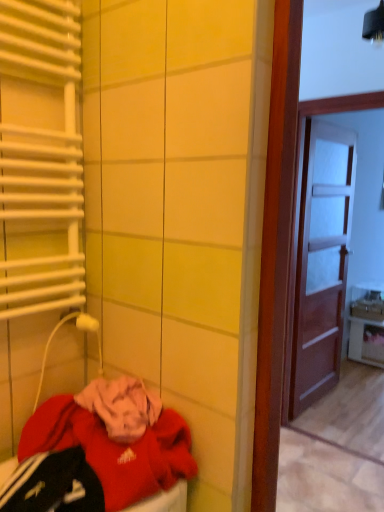
Question: Does white metallic radiator at left have a lesser width compared to white glossy cabinet at right?

Choices:
 (A) no
 (B) yes

Answer: (B)

Question: From the image's perspective, is white metallic radiator at left below white glossy cabinet at right?

Choices:
 (A) no
 (B) yes

Answer: (A)

Question: From a real-world perspective, is white metallic radiator at left located higher than white glossy cabinet at right?

Choices:
 (A) no
 (B) yes

Answer: (B)

Question: Does white metallic radiator at left come behind white glossy cabinet at right?

Choices:
 (A) yes
 (B) no

Answer: (B)

Question: Is white metallic radiator at left oriented towards white glossy cabinet at right?

Choices:
 (A) no
 (B) yes

Answer: (A)

Question: Does white metallic radiator at left have a lesser height compared to white glossy cabinet at right?

Choices:
 (A) yes
 (B) no

Answer: (B)

Question: Can you confirm if brown wooden door at right is bigger than white glossy cabinet at right?

Choices:
 (A) yes
 (B) no

Answer: (A)

Question: Considering the relative sizes of brown wooden door at right and white glossy cabinet at right in the image provided, is brown wooden door at right smaller than white glossy cabinet at right?

Choices:
 (A) yes
 (B) no

Answer: (B)

Question: Is brown wooden door at right further to the viewer compared to white glossy cabinet at right?

Choices:
 (A) yes
 (B) no

Answer: (B)

Question: Does brown wooden door at right have a greater height compared to white glossy cabinet at right?

Choices:
 (A) yes
 (B) no

Answer: (A)

Question: Is brown wooden door at right not within white glossy cabinet at right?

Choices:
 (A) yes
 (B) no

Answer: (A)

Question: Is brown wooden door at right thinner than white glossy cabinet at right?

Choices:
 (A) no
 (B) yes

Answer: (B)

Question: Is white glossy cabinet at right wider than white metallic radiator at left?

Choices:
 (A) no
 (B) yes

Answer: (B)